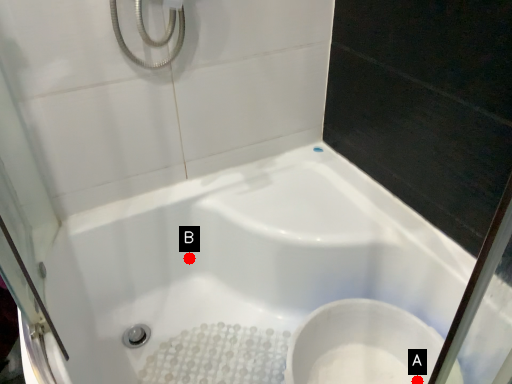
Question: Two points are circled on the image, labeled by A and B beside each circle. Which point appears closest to the camera in this image?

Choices:
 (A) A is closer
 (B) B is closer

Answer: (A)